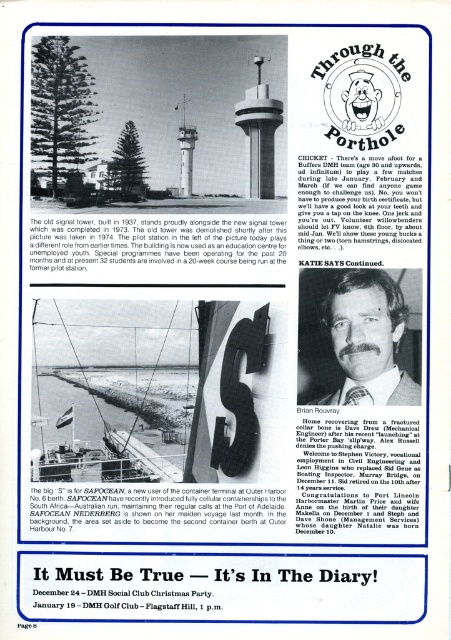
Looking at the two towers in the top section of the magazine layout, the smooth concrete tower at center and the white concrete tower at center, which one is taller?

The smooth concrete tower at center is much taller than the white concrete tower at center.